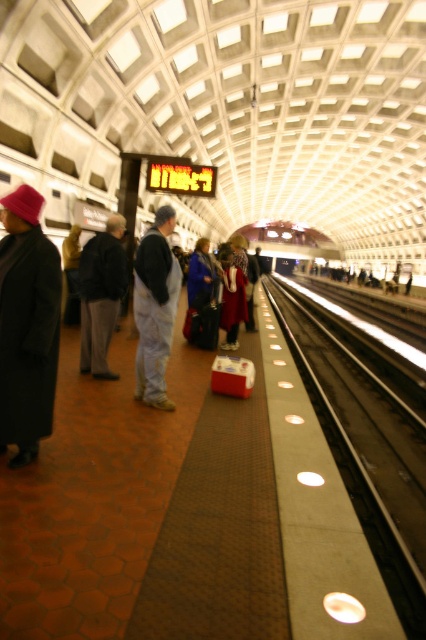
Question: Which of the following is the closest to the observer?

Choices:
 (A) metal/smooth train track at center-right
 (B) dark gray fabric jacket at left

Answer: (A)

Question: Is metal/smooth train track at center-right positioned before dark gray fabric jacket at left?

Choices:
 (A) no
 (B) yes

Answer: (B)

Question: Is metal/smooth train track at center-right below dark gray fabric jacket at left?

Choices:
 (A) yes
 (B) no

Answer: (A)

Question: Which of the following is the farthest from the observer?

Choices:
 (A) metal/smooth train track at center-right
 (B) dark gray fabric jacket at left

Answer: (B)

Question: Is metal/smooth train track at center-right wider than dark gray fabric jacket at left?

Choices:
 (A) no
 (B) yes

Answer: (B)